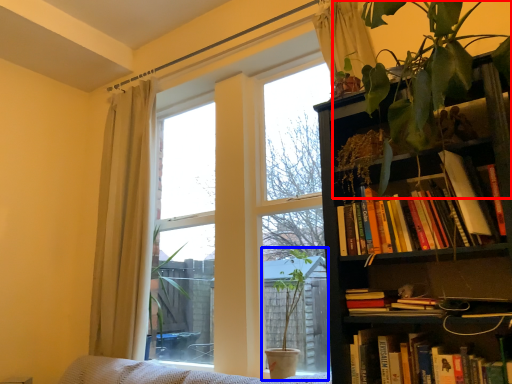
Question: Which object is closer to the camera taking this photo, vegetation (highlighted by a red box) or houseplant (highlighted by a blue box)?

Choices:
 (A) vegetation
 (B) houseplant

Answer: (A)